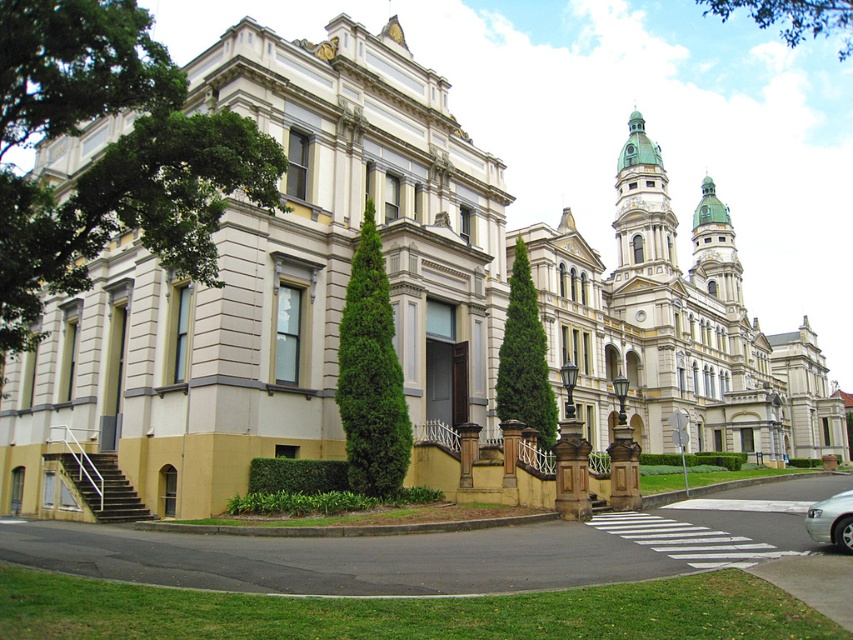
Which is above, green leafy tree at center or silver metallic sedan at lower right?

green leafy tree at center is above.

Can you confirm if green leafy tree at center is smaller than silver metallic sedan at lower right?

Indeed, green leafy tree at center has a smaller size compared to silver metallic sedan at lower right.

Where is `green leafy tree at center`? This screenshot has width=853, height=640. green leafy tree at center is located at coordinates (524, 356).

Between green leafy tree at upper center and silver metallic sedan at lower right, which one has less height?

With less height is silver metallic sedan at lower right.

You are a GUI agent. You are given a task and a screenshot of the screen. Output one action in this format:
    pyautogui.click(x=<x>, y=<y>)
    Task: Click on the green leafy tree at upper center
    
    Given the screenshot: What is the action you would take?
    pyautogui.click(x=793, y=17)

Does white stone church at upper center have a smaller size compared to green coniferous tree at center?

Incorrect, white stone church at upper center is not smaller in size than green coniferous tree at center.

Which of these two, white stone church at upper center or green coniferous tree at center, stands shorter?

Standing shorter between the two is green coniferous tree at center.

Is point (641, 193) more distant than point (404, 410)?

Yes, it is behind point (404, 410).

In order to click on white stone church at upper center in this screenshot , I will do `click(676, 326)`.